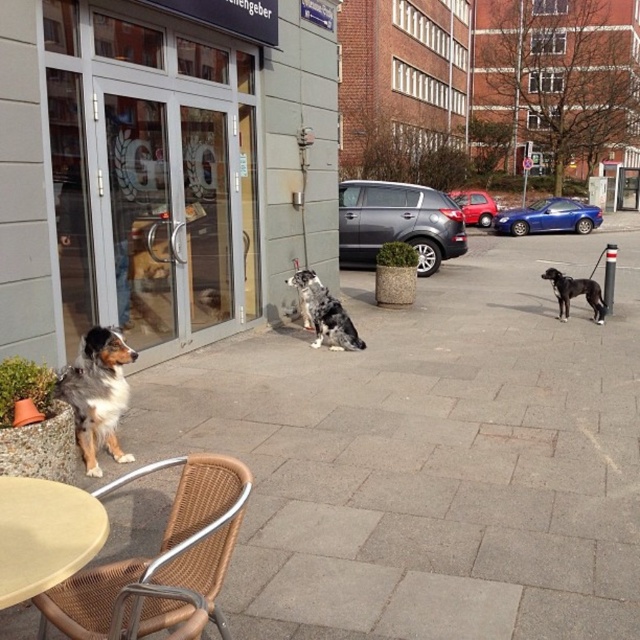
You are a delivery person holding a large package. You need to enter the building through the transparent glass doors at center but there is a rattan chair at lower left blocking the path. Can you still carry the package through the entrance without moving the chair?

The transparent glass doors at center is bigger than the rattan chair at lower left, so yes, you can carry the package through the entrance without moving the chair since the doors are larger in size.

You are standing on the sidewalk and want to enter the building through the transparent glass doors at center. According to the coordinates provided, are the doors located to your left or right side?

The transparent glass doors at center are located at coordinates point (154, 168), which would be to your left side if you are facing the building from the sidewalk.